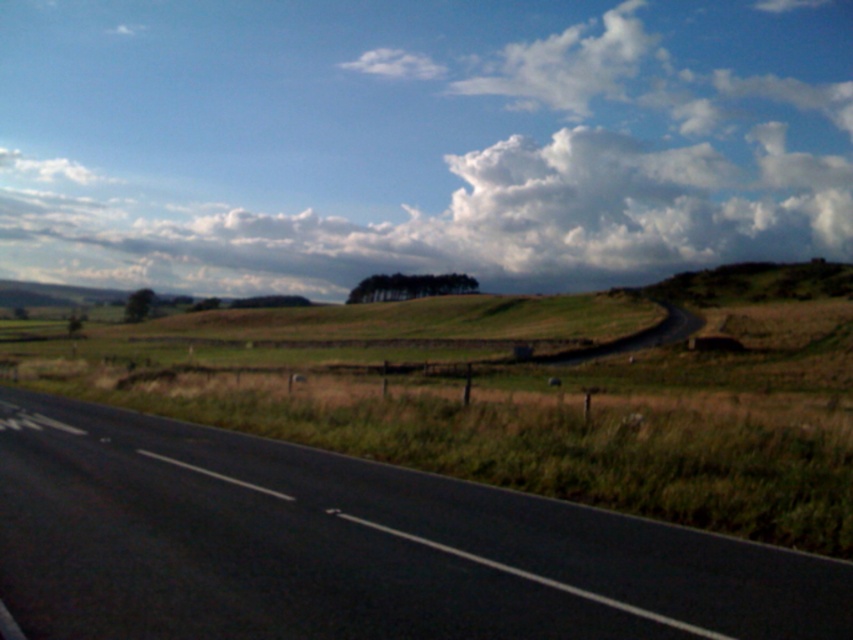
Does white fluffy cloud at upper center lie behind black asphalt highway at lower left?

Yes, it is behind black asphalt highway at lower left.

From the picture: Who is positioned more to the left, white fluffy cloud at upper center or black asphalt highway at lower left?

white fluffy cloud at upper center is more to the left.

Which is behind, point (264, 182) or point (311, 628)?

Positioned behind is point (264, 182).

Identify the location of white fluffy cloud at upper center. (419, 140).